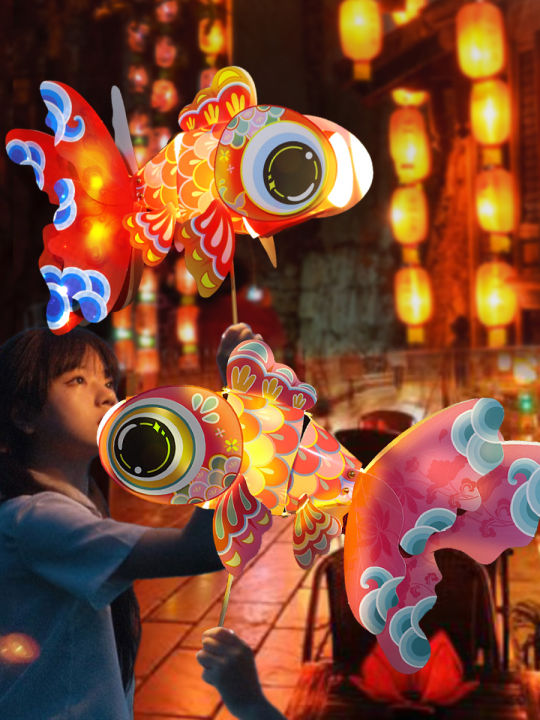
Locate an element on the screen. This screenshot has width=540, height=720. lighting is located at coordinates 366,24, 416,312, 492,301, 500,198, 411,217, 416,163, 485,111, 470,40.